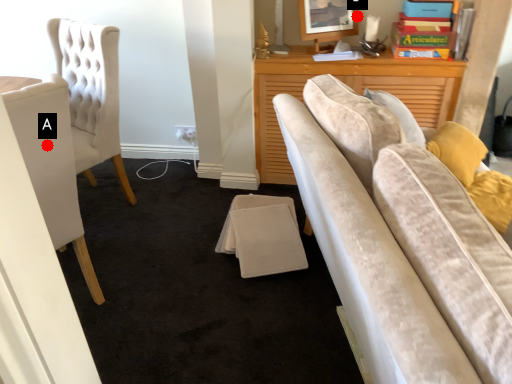
Question: Two points are circled on the image, labeled by A and B beside each circle. Among these points, which one is nearest to the camera?

Choices:
 (A) A is closer
 (B) B is closer

Answer: (A)